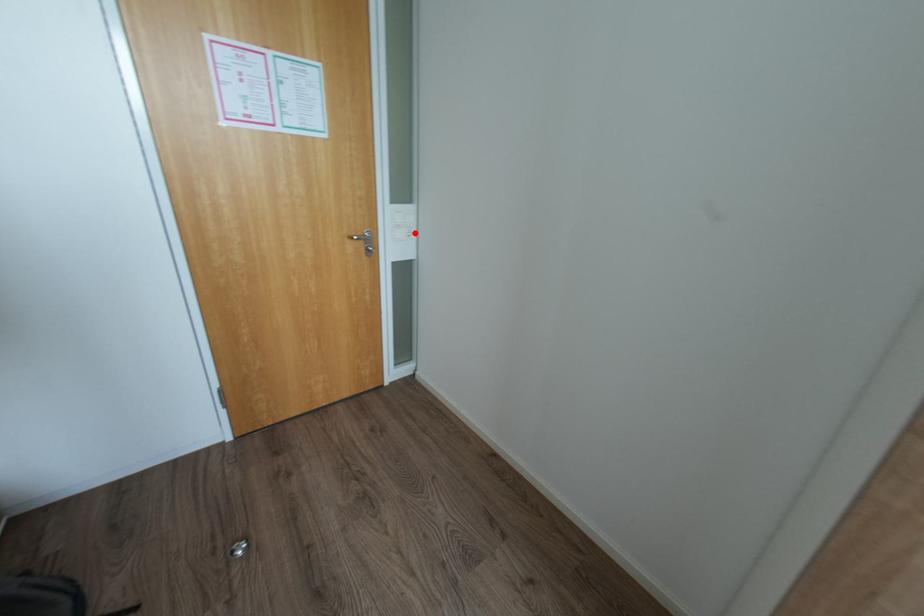
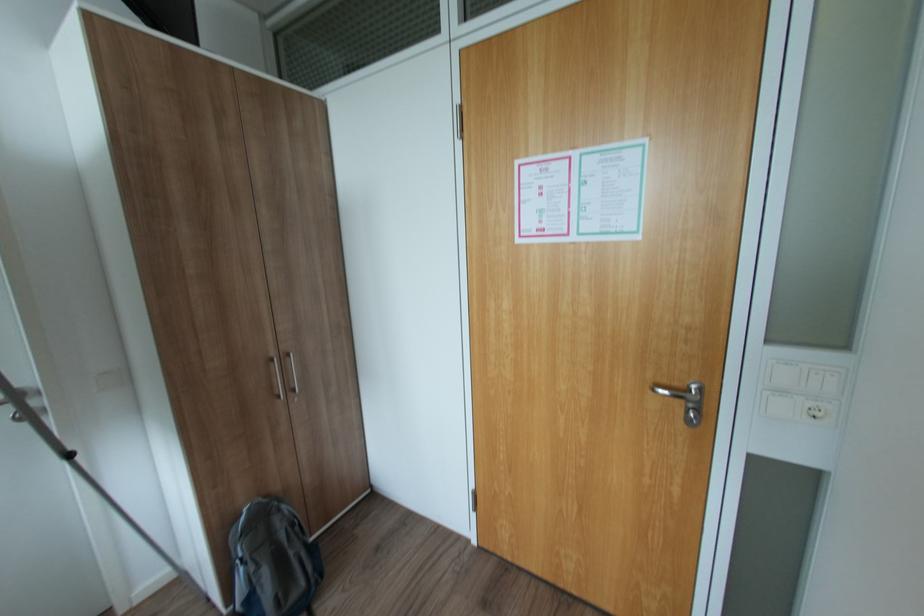
Find the pixel in the second image that matches the highlighted location in the first image.

(820, 414)